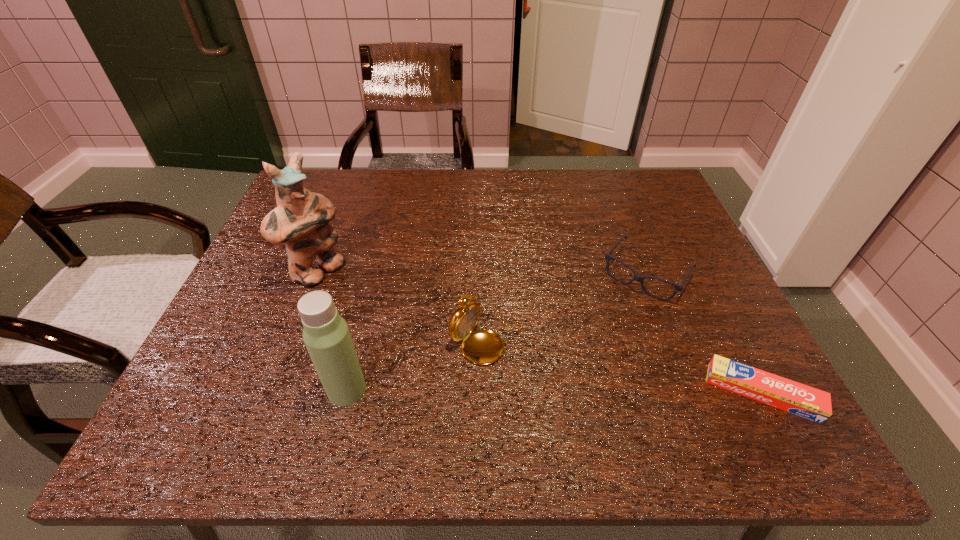
You are a GUI agent. You are given a task and a screenshot of the screen. Output one action in this format:
    pyautogui.click(x=<x>, y=<y>)
    Task: Click on the second tallest object
    The image size is (960, 540).
    Given the screenshot: What is the action you would take?
    pyautogui.click(x=326, y=335)

This screenshot has width=960, height=540. Identify the location of thermos bottle. (326, 335).

At what (x,y) coordinates should I click in order to perform the action: click on the shortest object. Please return your answer as a coordinate pair (x, y). The height and width of the screenshot is (540, 960). Looking at the image, I should click on (779, 392).

The width and height of the screenshot is (960, 540). In order to click on the leftmost object in this screenshot , I will do `click(301, 219)`.

The image size is (960, 540). What are the coordinates of `the tallest object` in the screenshot? It's located at (301, 219).

I want to click on the third tallest object, so click(x=482, y=346).

Where is `pocket watch`? pocket watch is located at coordinates (482, 346).

Find the location of a particular element. The width and height of the screenshot is (960, 540). spectacles is located at coordinates (638, 278).

Locate an element on the screen. Image resolution: width=960 pixels, height=540 pixels. free space located on the back of the fourth object from right to left is located at coordinates [372, 290].

The width and height of the screenshot is (960, 540). I want to click on blank space located 0.090m on the left of the toothpaste, so click(662, 393).